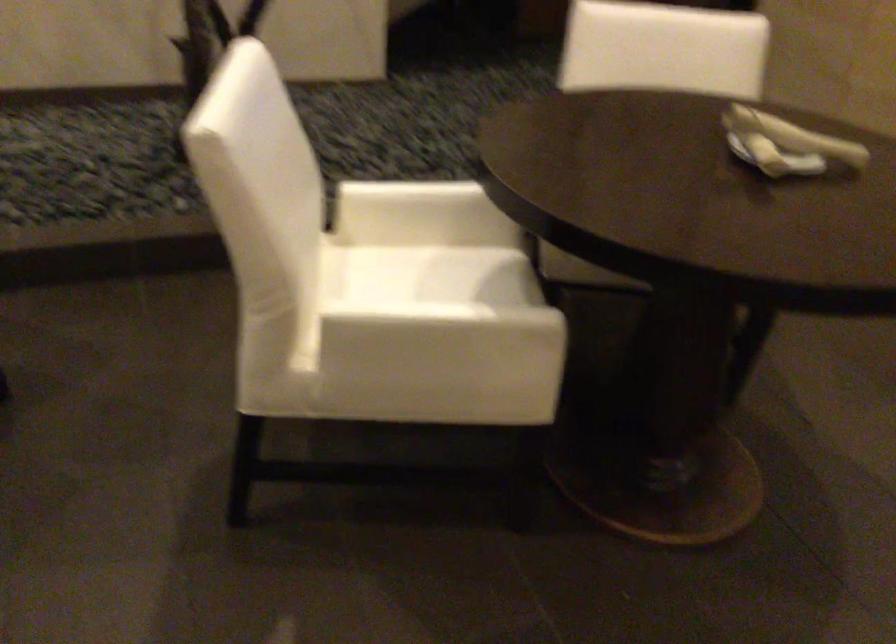
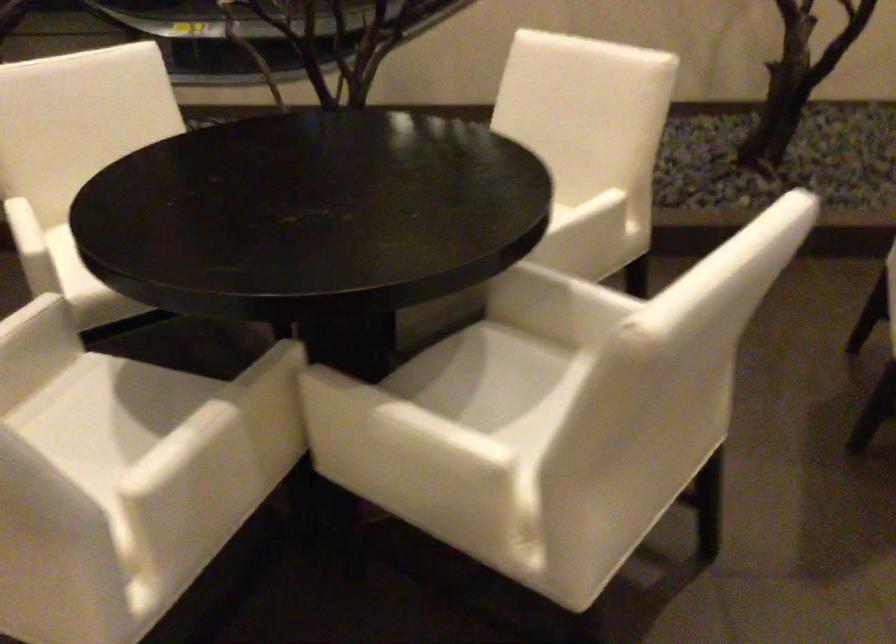
Question: The camera is either moving clockwise (left) or counter-clockwise (right) around the object. The first image is from the beginning of the video and the second image is from the end. Is the camera moving left or right when shooting the video?

Choices:
 (A) Left
 (B) Right

Answer: (B)